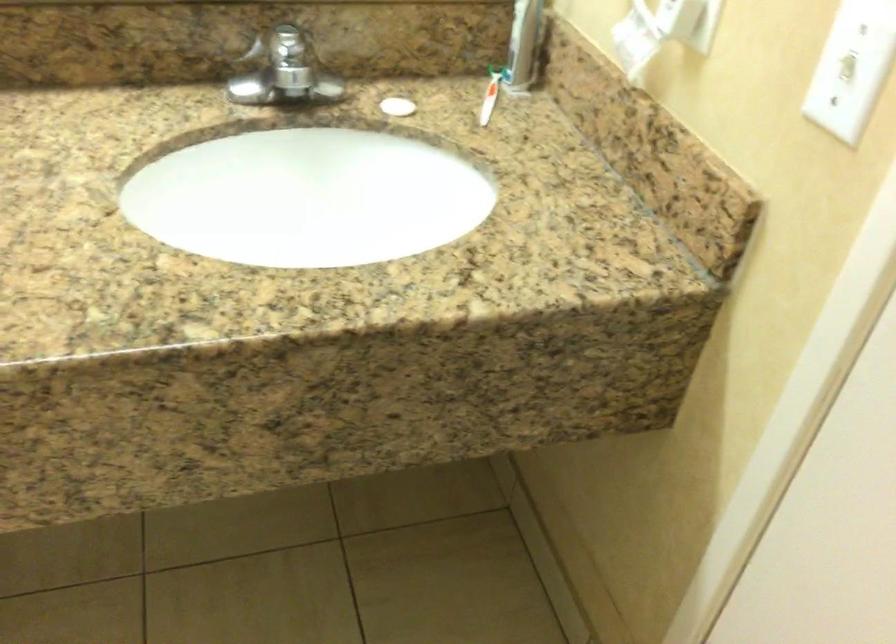
This screenshot has width=896, height=644. Describe the element at coordinates (398, 106) in the screenshot. I see `a white soap bar` at that location.